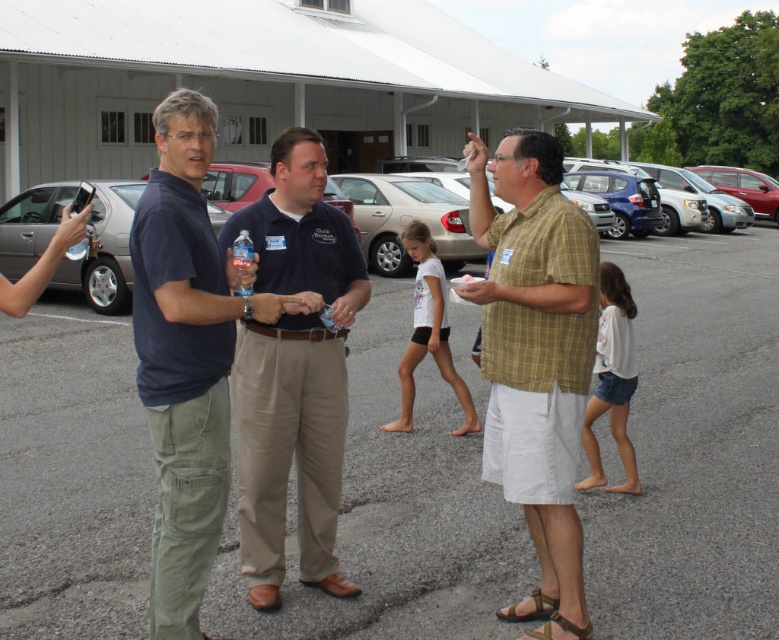
You are standing at the edge of the gray asphalt parking lot at center and looking towards the yellow plaid shirt at center. Which object is higher from your viewpoint?

The yellow plaid shirt at center is higher than the gray asphalt parking lot at center because the gray asphalt parking lot at center is located below it.

From the picture: You are a photographer trying to capture a candid shot of the man in the yellow plaid shirt at center without including the khaki cotton pants at center in the frame. Based on their positions, is this possible?

The yellow plaid shirt at center is in front of the khaki cotton pants at center, so it is possible to capture the man in the yellow plaid shirt at center without including the khaki cotton pants at center in the frame by focusing on the front area.

You are a fashion designer observing the two central figures in the image. You need to determine which clothing item is narrower between the yellow plaid shirt at center and the khaki cotton pants at center. Which one is narrower?

The yellow plaid shirt at center is narrower than the khaki cotton pants at center according to the description provided.